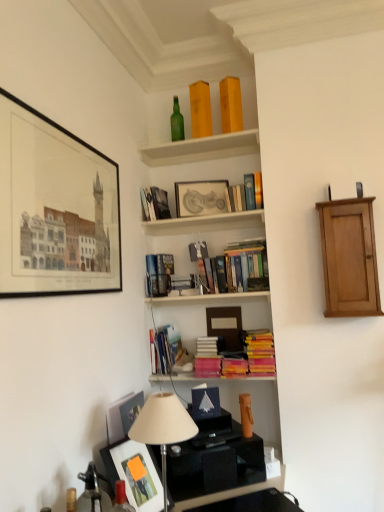
Find the location of a particular element. This screenshot has height=512, width=384. vacant space situated above matte black picture frame at upper left, which ranks as the 1th picture frame in front-to-back order (from a real-world perspective) is located at coordinates click(x=68, y=132).